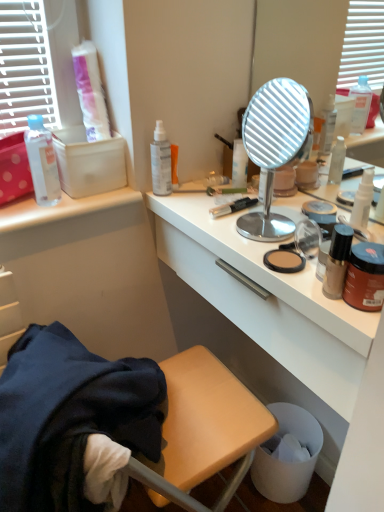
Image resolution: width=384 pixels, height=512 pixels. I want to click on blank space above white glossy desk at center (from a real-world perspective), so click(258, 224).